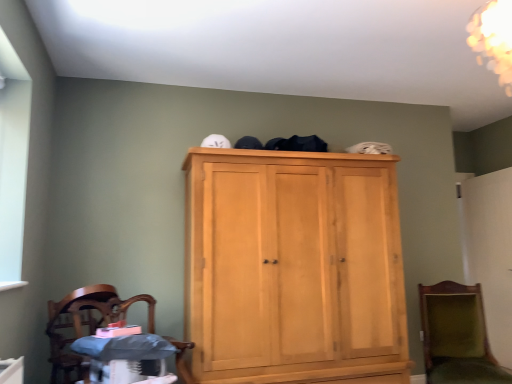
Question: Is matte gray changing table at lower left taller than light wood cupboard at center?

Choices:
 (A) no
 (B) yes

Answer: (A)

Question: Is matte gray changing table at lower left positioned behind light wood cupboard at center?

Choices:
 (A) no
 (B) yes

Answer: (A)

Question: Is matte gray changing table at lower left at the right side of light wood cupboard at center?

Choices:
 (A) yes
 (B) no

Answer: (B)

Question: Considering the relative sizes of matte gray changing table at lower left and light wood cupboard at center in the image provided, is matte gray changing table at lower left shorter than light wood cupboard at center?

Choices:
 (A) no
 (B) yes

Answer: (B)

Question: Is matte gray changing table at lower left facing away from light wood cupboard at center?

Choices:
 (A) yes
 (B) no

Answer: (B)

Question: Is matte gray changing table at lower left closer to camera compared to light wood cupboard at center?

Choices:
 (A) no
 (B) yes

Answer: (B)

Question: Considering the relative sizes of light wood cupboard at center and wooden polished chair at lower left, arranged as the 2th chair when viewed from the back, in the image provided, is light wood cupboard at center shorter than wooden polished chair at lower left, arranged as the 2th chair when viewed from the back,?

Choices:
 (A) no
 (B) yes

Answer: (A)

Question: From the image's perspective, would you say light wood cupboard at center is shown under wooden polished chair at lower left, arranged as the 2th chair when viewed from the back?

Choices:
 (A) no
 (B) yes

Answer: (A)

Question: Does light wood cupboard at center turn towards wooden polished chair at lower left, which ranks as the first chair in front-to-back order?

Choices:
 (A) no
 (B) yes

Answer: (A)

Question: Does light wood cupboard at center have a larger size compared to wooden polished chair at lower left, which is the 2th chair in right-to-left order?

Choices:
 (A) no
 (B) yes

Answer: (B)

Question: Is light wood cupboard at center further to camera compared to wooden polished chair at lower left, arranged as the 1th chair when viewed from the left?

Choices:
 (A) yes
 (B) no

Answer: (A)

Question: Can you confirm if light wood cupboard at center is thinner than wooden polished chair at lower left, arranged as the 1th chair when viewed from the left?

Choices:
 (A) yes
 (B) no

Answer: (B)

Question: From a real-world perspective, does wooden polished chair at lower left, which ranks as the first chair in front-to-back order, sit lower than green velvet chair at lower right, which appears as the 2th chair when viewed from the left?

Choices:
 (A) yes
 (B) no

Answer: (B)